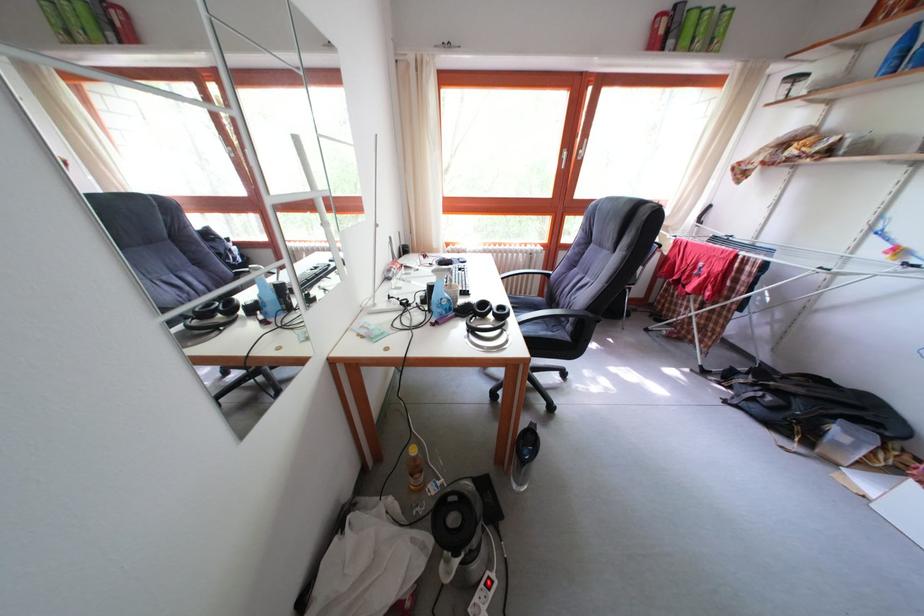
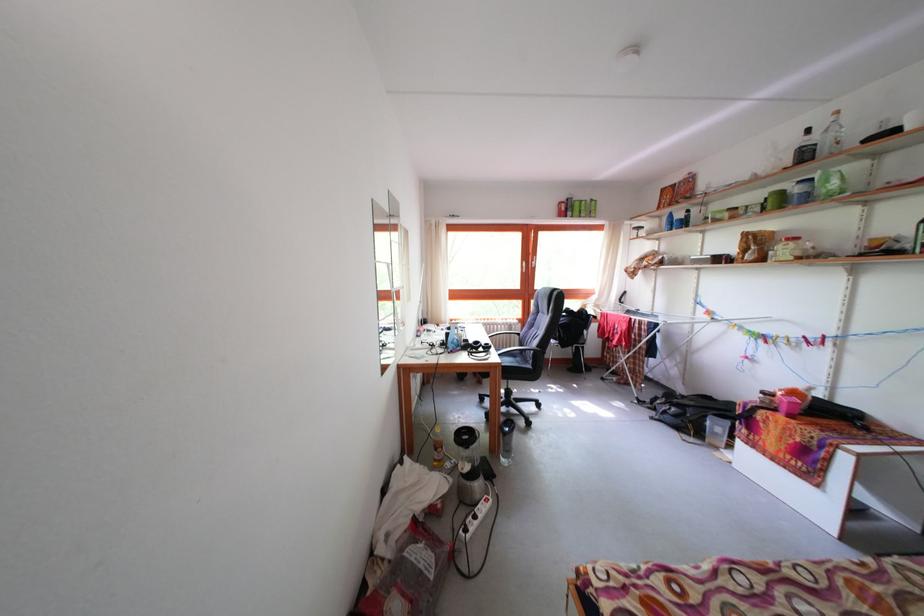
Question: What movement of the cameraman would produce the second image?

Choices:
 (A) Left
 (B) Right
 (C) Forward
 (D) Backward

Answer: (D)